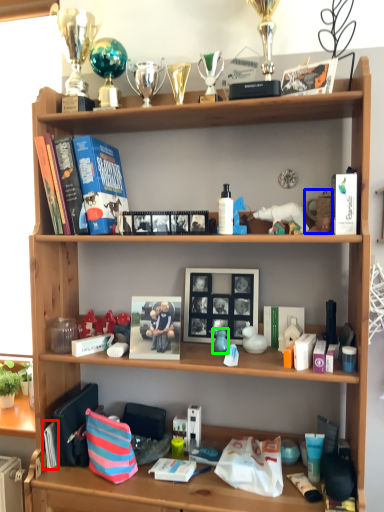
Question: Considering the real-world distances, which object is farthest from book (highlighted by a red box)? toy (highlighted by a blue box) or toy (highlighted by a green box)?

Choices:
 (A) toy
 (B) toy

Answer: (A)